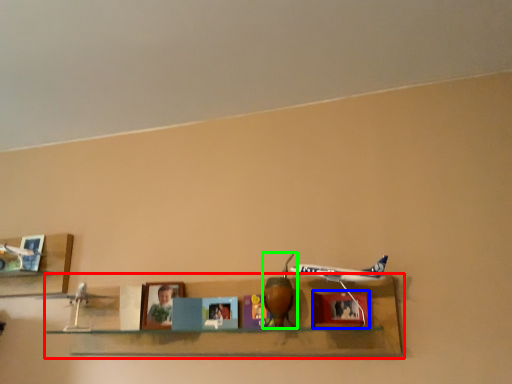
Question: Estimate the real-world distances between objects in this image. Which object is farther from shelf (highlighted by a red box), picture frame (highlighted by a blue box) or toy (highlighted by a green box)?

Choices:
 (A) picture frame
 (B) toy

Answer: (B)